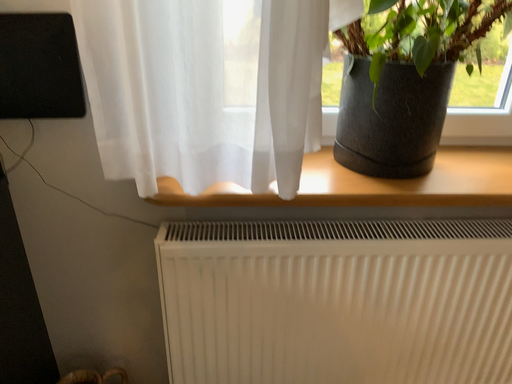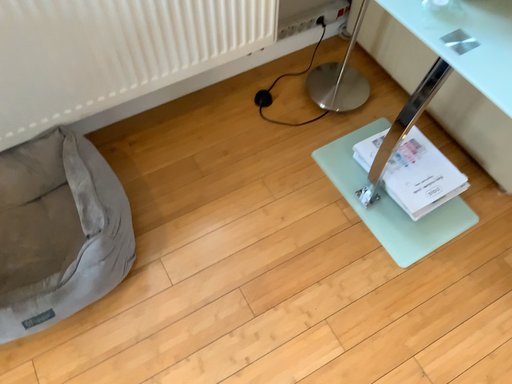
Question: Which way did the camera rotate in the video?

Choices:
 (A) rotated left
 (B) rotated right

Answer: (B)